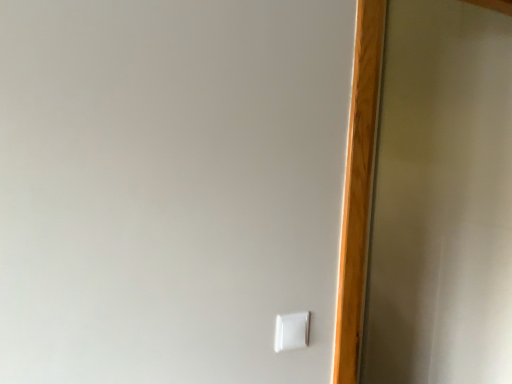
Question: Considering their positions, is white plastic light switch at lower right located in front of or behind transparent glass screen door at right?

Choices:
 (A) behind
 (B) front

Answer: (B)

Question: Considering the positions of point (300, 324) and point (429, 190), is point (300, 324) closer or farther from the camera than point (429, 190)?

Choices:
 (A) farther
 (B) closer

Answer: (B)

Question: From a real-world perspective, is white plastic light switch at lower right physically located above or below transparent glass screen door at right?

Choices:
 (A) below
 (B) above

Answer: (A)

Question: In terms of width, does transparent glass screen door at right look wider or thinner when compared to white plastic light switch at lower right?

Choices:
 (A) thin
 (B) wide

Answer: (B)

Question: From a real-world perspective, is transparent glass screen door at right above or below white plastic light switch at lower right?

Choices:
 (A) below
 (B) above

Answer: (B)

Question: Which is correct: transparent glass screen door at right is inside white plastic light switch at lower right, or outside of it?

Choices:
 (A) outside
 (B) inside

Answer: (A)

Question: Considering the positions of transparent glass screen door at right and white plastic light switch at lower right in the image, is transparent glass screen door at right taller or shorter than white plastic light switch at lower right?

Choices:
 (A) short
 (B) tall

Answer: (B)